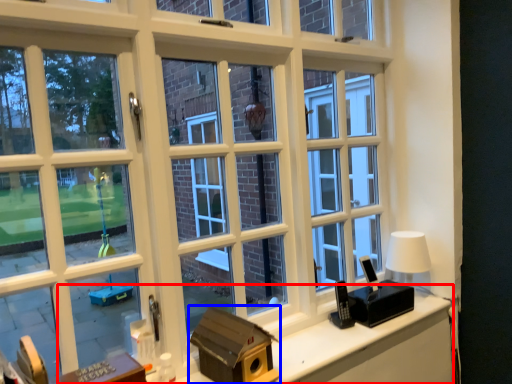
Question: Which object is closer to the camera taking this photo, computer desk (highlighted by a red box) or box (highlighted by a blue box)?

Choices:
 (A) computer desk
 (B) box

Answer: (A)